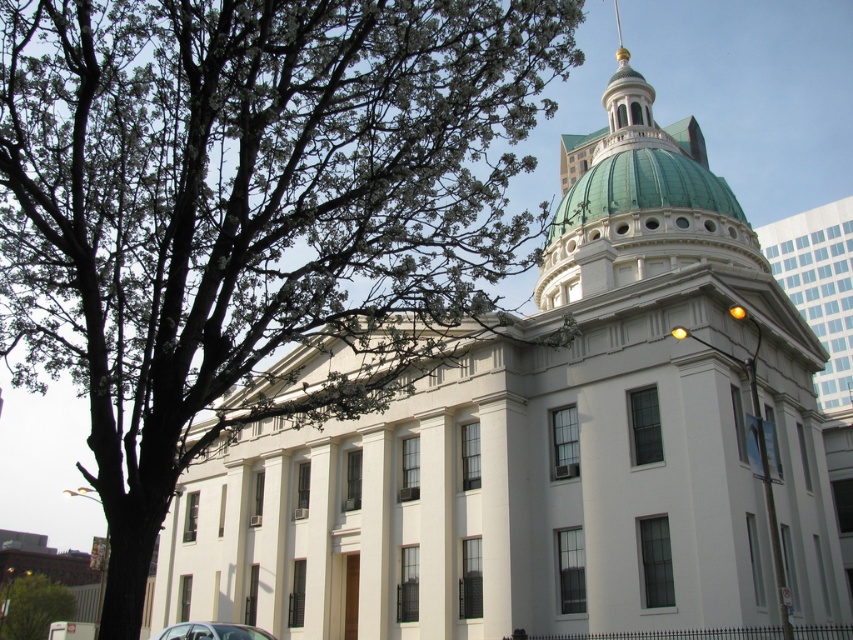
Question: Can you confirm if green leafy tree at lower left is smaller than metallic silver car at lower left?

Choices:
 (A) yes
 (B) no

Answer: (B)

Question: Which point is farther to the camera?

Choices:
 (A) green leafy tree at upper left
 (B) metallic silver car at lower left

Answer: (B)

Question: Among these objects, which one is farthest from the camera?

Choices:
 (A) green leafy tree at lower left
 (B) metallic silver car at lower left
 (C) green leafy tree at upper left

Answer: (A)

Question: Does green leafy tree at upper left have a lesser width compared to green leafy tree at lower left?

Choices:
 (A) no
 (B) yes

Answer: (A)

Question: Which object appears farthest from the camera in this image?

Choices:
 (A) green leafy tree at upper left
 (B) green leafy tree at lower left

Answer: (B)

Question: Can you confirm if green leafy tree at lower left is smaller than metallic silver car at lower left?

Choices:
 (A) yes
 (B) no

Answer: (B)